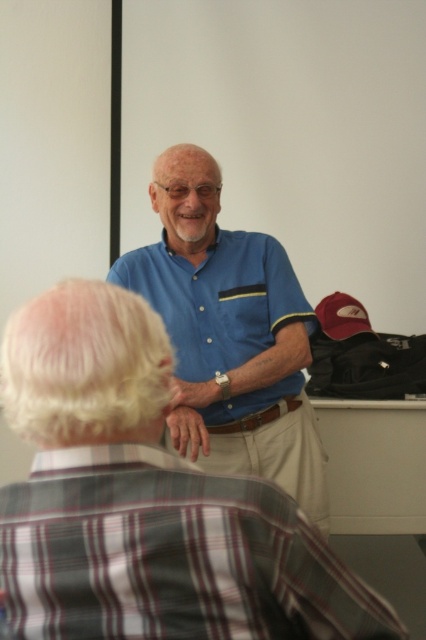
Question: Is plaid cotton shirt at lower left to the right of matte blue polo shirt at center from the viewer's perspective?

Choices:
 (A) yes
 (B) no

Answer: (B)

Question: Can you confirm if plaid cotton shirt at lower left is wider than matte blue polo shirt at center?

Choices:
 (A) no
 (B) yes

Answer: (A)

Question: Which point appears farthest from the camera in this image?

Choices:
 (A) (276, 288)
 (B) (379, 636)

Answer: (A)

Question: Which of the following is the closest to the observer?

Choices:
 (A) plaid cotton shirt at lower left
 (B) blue cotton shirt at center

Answer: (A)

Question: Observing the image, what is the correct spatial positioning of plaid cotton shirt at lower left in reference to blue cotton shirt at center?

Choices:
 (A) right
 (B) left

Answer: (B)

Question: Which point appears farthest from the camera in this image?

Choices:
 (A) (275, 612)
 (B) (236, 332)
 (C) (167, 241)

Answer: (C)